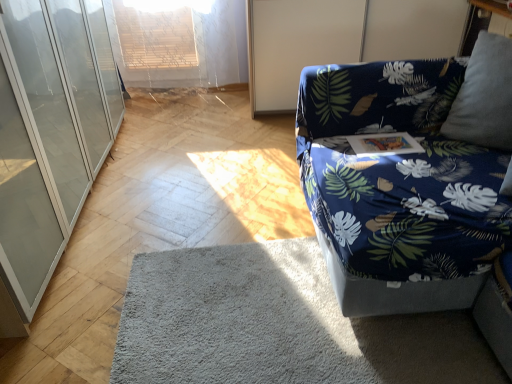
The image size is (512, 384). Identify the location of free space behind gray soft rug at lower center. (219, 185).